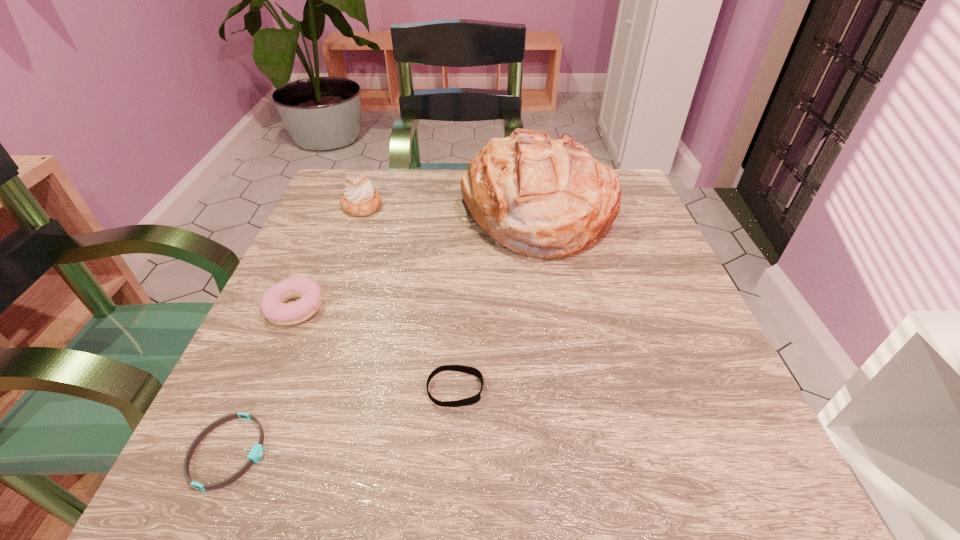
Identify the location of vacant space located on the back of the third farthest object. Image resolution: width=960 pixels, height=540 pixels. (328, 231).

Where is `vacant area situated 0.150m on the display of the right wristband`? The height and width of the screenshot is (540, 960). vacant area situated 0.150m on the display of the right wristband is located at coordinates (586, 389).

The width and height of the screenshot is (960, 540). I want to click on free space located 0.110m on the buckle of the nearer wristband, so click(348, 452).

Where is `bread that is at the far edge`? The width and height of the screenshot is (960, 540). bread that is at the far edge is located at coordinates (540, 197).

You are a GUI agent. You are given a task and a screenshot of the screen. Output one action in this format:
    pyautogui.click(x=<x>, y=<y>)
    Task: Click on the pastry at the far edge
    The width and height of the screenshot is (960, 540).
    Given the screenshot: What is the action you would take?
    pyautogui.click(x=360, y=199)

You are a GUI agent. You are given a task and a screenshot of the screen. Output one action in this format:
    pyautogui.click(x=<x>, y=<y>)
    Task: Click on the object present at the near edge
    This screenshot has height=540, width=960.
    Given the screenshot: What is the action you would take?
    pyautogui.click(x=255, y=454)

At what (x,y) coordinates should I click in order to perform the action: click on pastry located at the left edge. Please return your answer as a coordinate pair (x, y). The width and height of the screenshot is (960, 540). Looking at the image, I should click on (360, 199).

Locate an element on the screen. doughnut located at the left edge is located at coordinates pos(272,305).

The image size is (960, 540). I want to click on wristband at the left edge, so click(255, 454).

This screenshot has width=960, height=540. Identify the location of object that is positioned at the right edge. (540, 197).